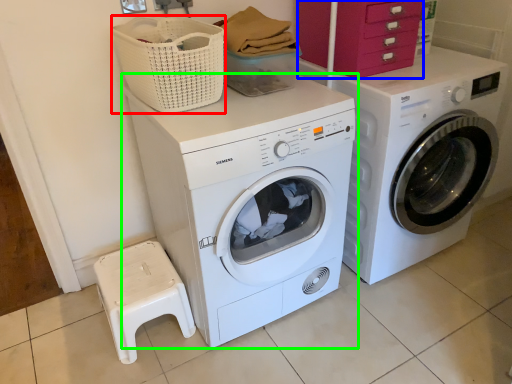
Question: Which object is the closest to the basket (highlighted by a red box)? Choose among these: drawer (highlighted by a blue box) or washing machine (highlighted by a green box).

Choices:
 (A) drawer
 (B) washing machine

Answer: (B)